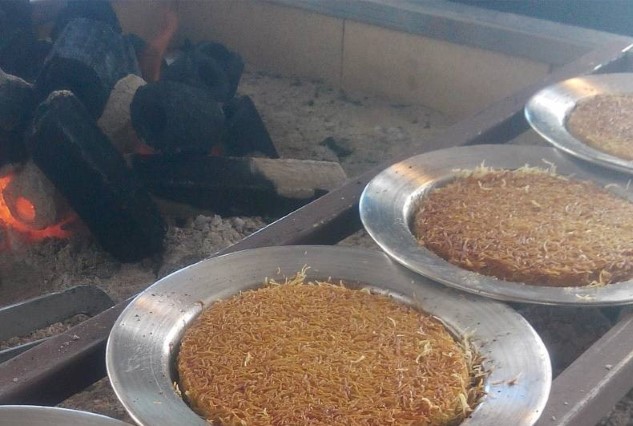
This screenshot has height=426, width=633. In order to click on plate 1 in this screenshot , I will do `click(171, 313)`.